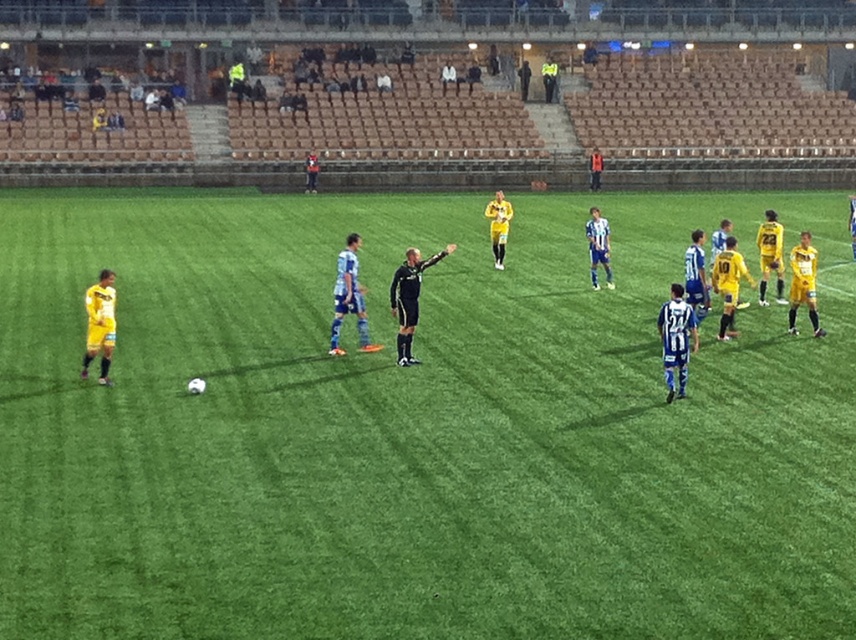
Between point (605, 262) and point (414, 266), which one is positioned behind?

The point (605, 262) is behind.

Can you confirm if yellow jersey at center is bigger than black smooth referee at center?

Yes.

Image resolution: width=856 pixels, height=640 pixels. Describe the element at coordinates (352, 289) in the screenshot. I see `yellow jersey at center` at that location.

Image resolution: width=856 pixels, height=640 pixels. I want to click on yellow jersey at center, so click(x=352, y=289).

Does point (542, 545) come closer to viewer compared to point (346, 257)?

Yes, point (542, 545) is in front of point (346, 257).

Does green artificial turf at center have a larger size compared to yellow jersey at center?

Yes.

Image resolution: width=856 pixels, height=640 pixels. I want to click on green artificial turf at center, so click(412, 428).

Consider the image. Is green artificial turf at center to the left of black smooth referee at center from the viewer's perspective?

Incorrect, green artificial turf at center is not on the left side of black smooth referee at center.

This screenshot has width=856, height=640. Describe the element at coordinates (412, 428) in the screenshot. I see `green artificial turf at center` at that location.

At what (x,y) coordinates should I click in order to perform the action: click on green artificial turf at center. Please return your answer as a coordinate pair (x, y). This screenshot has width=856, height=640. Looking at the image, I should click on click(412, 428).